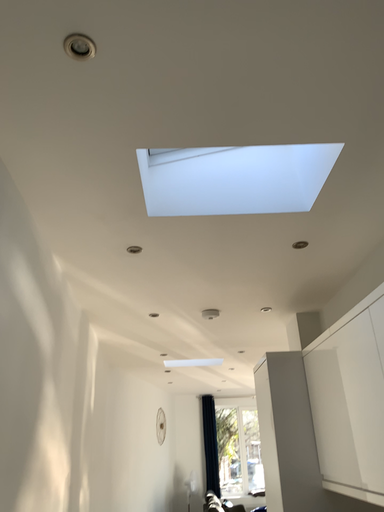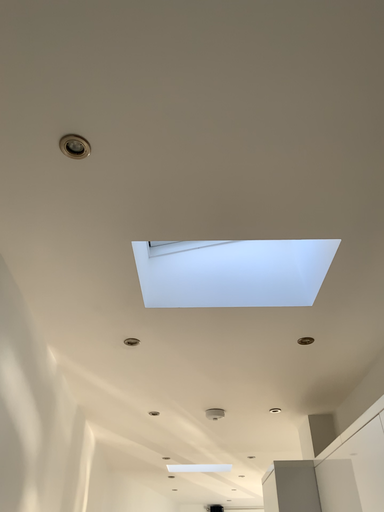
Question: Which way did the camera rotate in the video?

Choices:
 (A) rotated downward
 (B) rotated upward

Answer: (B)